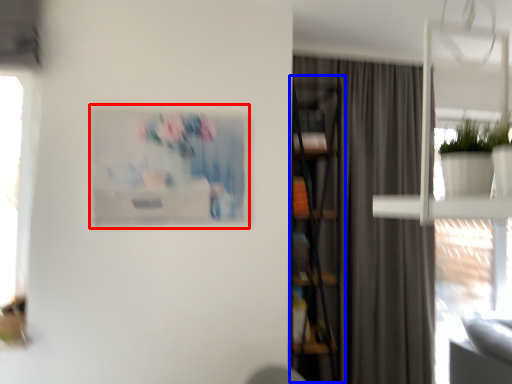
Question: Which object appears closest to the camera in this image, picture frame (highlighted by a red box) or bookcase (highlighted by a blue box)?

Choices:
 (A) picture frame
 (B) bookcase

Answer: (A)